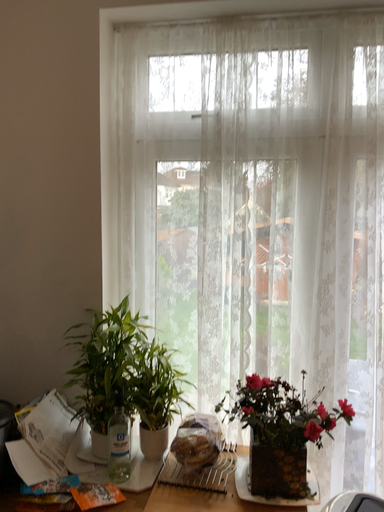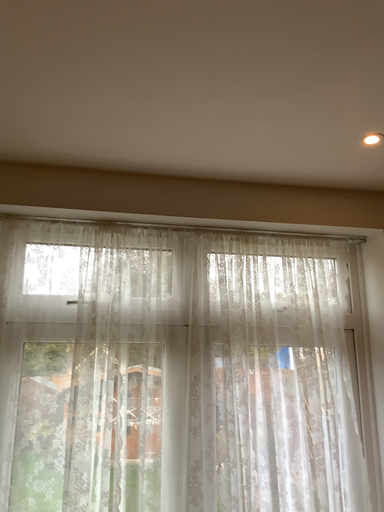
Question: How did the camera likely rotate when shooting the video?

Choices:
 (A) rotated upward
 (B) rotated downward

Answer: (A)